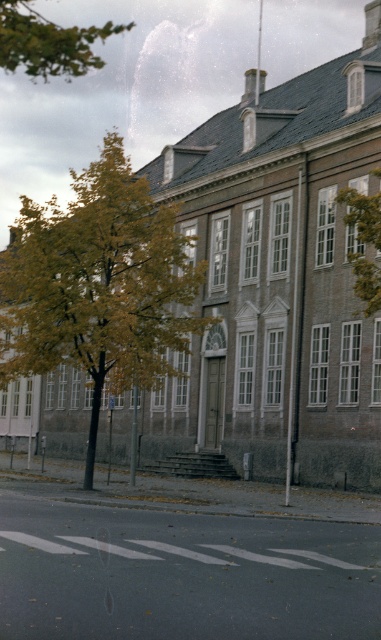
Looking at this image, you are a landscape architect planning to replace the green leafy tree at upper right and the white plastic sign at center with new elements. If you want to maintain the current spatial balance between them, which element should you choose a wider version of?

The green leafy tree at upper right is wider than the white plastic sign at center. To maintain spatial balance, you should choose a wider version of the white plastic sign at center so that it matches the width of the tree.